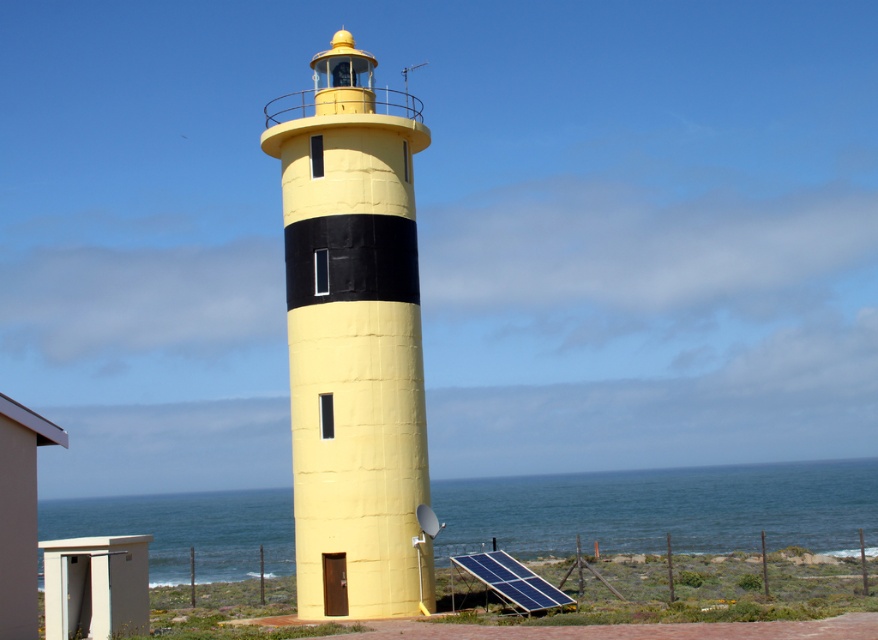
You are standing in front of the lighthouse and want to determine the relative positions of two points marked on the lighthouse structure. The points are labeled as point 1 at coordinates point (x=420, y=595) and point 2 at coordinates point (x=657, y=516). Which point is nearer to your current viewpoint?

Point 1 at coordinates point (x=420, y=595) is closer to the camera than point 2 at coordinates point (x=657, y=516).